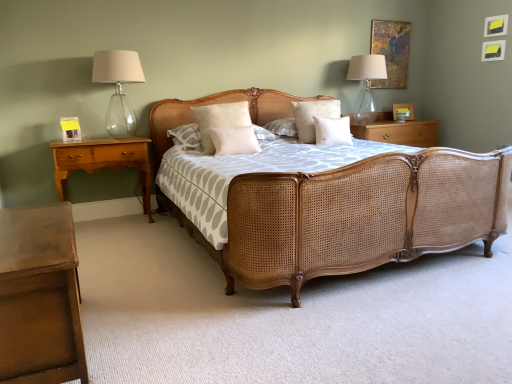
Question: Is clear glass lampshade at left, marked as the second bedside lamp in a right-to-left arrangement, completely or partially inside wooden nightstand at right, placed as the first nightstand when sorted from back to front?

Choices:
 (A) no
 (B) yes

Answer: (A)

Question: From the image's perspective, is wooden nightstand at right, placed as the first nightstand when sorted from back to front, below clear glass lampshade at left, which is the 1th bedside lamp in left-to-right order?

Choices:
 (A) no
 (B) yes

Answer: (B)

Question: Is wooden nightstand at right, the 1th nightstand viewed from the right, at the left side of clear glass lampshade at left, which is the 1th bedside lamp in left-to-right order?

Choices:
 (A) no
 (B) yes

Answer: (A)

Question: Does wooden nightstand at right, placed as the first nightstand when sorted from back to front, lie in front of clear glass lampshade at left, which is the 1th bedside lamp in left-to-right order?

Choices:
 (A) no
 (B) yes

Answer: (A)

Question: Is wooden nightstand at right, placed as the first nightstand when sorted from back to front, oriented towards clear glass lampshade at left, arranged as the 2th bedside lamp when viewed from the back?

Choices:
 (A) no
 (B) yes

Answer: (A)

Question: Is wooden nightstand at right, placed as the 3th nightstand when sorted from left to right, at the right side of clear glass lampshade at left, which ranks as the 1th bedside lamp in front-to-back order?

Choices:
 (A) no
 (B) yes

Answer: (B)

Question: Is wooden nightstand at right, the 1th nightstand viewed from the right, aimed at beige cotton pillow at center, placed as the 2th pillow when sorted from right to left?

Choices:
 (A) yes
 (B) no

Answer: (B)

Question: From a real-world perspective, is wooden nightstand at right, the 1th nightstand viewed from the right, on beige cotton pillow at center, placed as the 2th pillow when sorted from right to left?

Choices:
 (A) no
 (B) yes

Answer: (A)

Question: Does wooden nightstand at right, the 1th nightstand viewed from the right, appear on the left side of beige cotton pillow at center, placed as the 2th pillow when sorted from right to left?

Choices:
 (A) no
 (B) yes

Answer: (A)

Question: Does wooden nightstand at right, the 1th nightstand viewed from the right, lie behind beige cotton pillow at center, marked as the 3th pillow in a left-to-right arrangement?

Choices:
 (A) no
 (B) yes

Answer: (B)

Question: Is wooden nightstand at right, which is the 3th nightstand from front to back, taller than beige cotton pillow at center, marked as the 3th pillow in a left-to-right arrangement?

Choices:
 (A) no
 (B) yes

Answer: (A)

Question: Considering the relative positions of wooden nightstand at right, the 1th nightstand viewed from the right, and beige cotton pillow at center, marked as the 3th pillow in a left-to-right arrangement, in the image provided, is wooden nightstand at right, the 1th nightstand viewed from the right, to the right of beige cotton pillow at center, marked as the 3th pillow in a left-to-right arrangement, from the viewer's perspective?

Choices:
 (A) no
 (B) yes

Answer: (B)

Question: Can you confirm if white soft pillow at center, which is counted as the 3th pillow, starting from the right, is positioned to the right of transparent glass lampshade at upper right, which is the 1th bedside lamp from back to front?

Choices:
 (A) no
 (B) yes

Answer: (A)